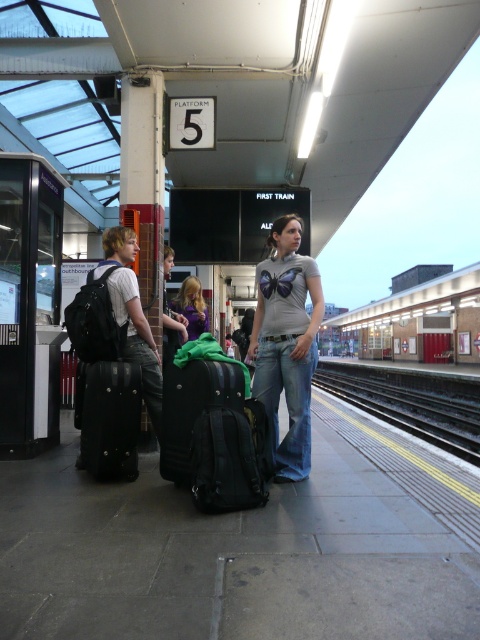
You are a baggage handler at the train station and need to place the black textured suitcase at center and the matte purple shirt at center into a storage compartment. The compartment has a width of 40 cm. Can both items fit side by side?

The black textured suitcase at center is wider than the matte purple shirt at center. Since the compartment is 40 cm wide, it depends on the combined width of both items. However, since the suitcase alone is already wider than the shirt, but the exact dimensions aren

You are a traveler at the train station and need to decide which of your items to place under the seat in the train. Given that the space under the seat is only large enough for the smaller item, which item should you choose between the black textured suitcase at center and the matte black backpack at left?

The black textured suitcase at center is smaller than the matte black backpack at left, so you should choose the black textured suitcase at center to place under the seat.

You are standing at the train station platform and want to reach the point marked as point (223,483). Can you walk directly to it from your current position?

Yes, you can walk directly to point (223,483) since there are no obstructions mentioned between you and the point, and it is 11.74 feet away from the camera position.